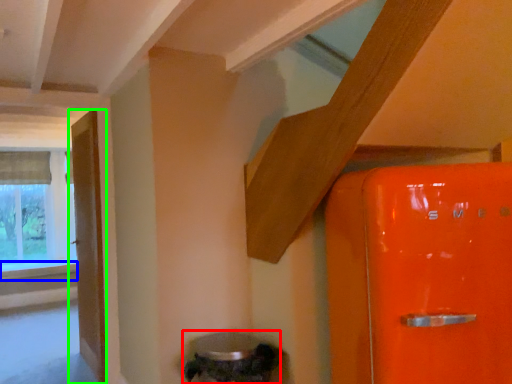
Question: Considering the real-world distances, which object is farthest from water heater (highlighted by a red box)? window sill (highlighted by a blue box) or door (highlighted by a green box)?

Choices:
 (A) window sill
 (B) door

Answer: (A)